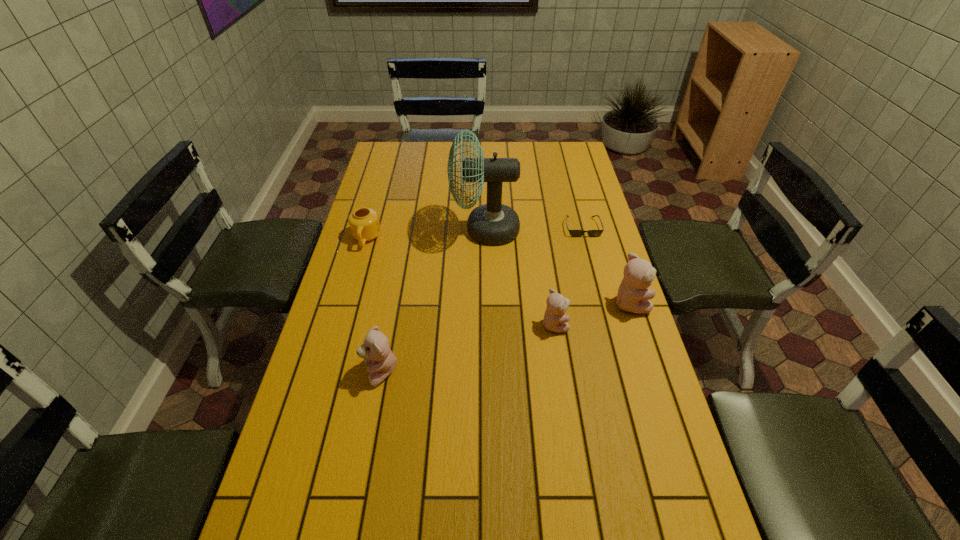
What are the coordinates of `the second shortest teddy bear` in the screenshot? It's located at (375, 350).

Image resolution: width=960 pixels, height=540 pixels. Find the location of `the nearest object`. the nearest object is located at coordinates (375, 350).

What are the coordinates of `the fourth object from left to right` in the screenshot? It's located at (x=557, y=304).

Locate an element on the screen. the second teddy bear from right to left is located at coordinates (557, 304).

Identify the location of the rightmost teddy bear. The width and height of the screenshot is (960, 540). (633, 297).

Identify the location of fan. (493, 223).

This screenshot has height=540, width=960. What are the coordinates of `the tallest object` in the screenshot? It's located at (493, 223).

Image resolution: width=960 pixels, height=540 pixels. I want to click on the leftmost object, so click(364, 224).

Image resolution: width=960 pixels, height=540 pixels. I want to click on the fifth tallest object, so click(364, 224).

This screenshot has width=960, height=540. I want to click on the shortest object, so click(x=575, y=233).